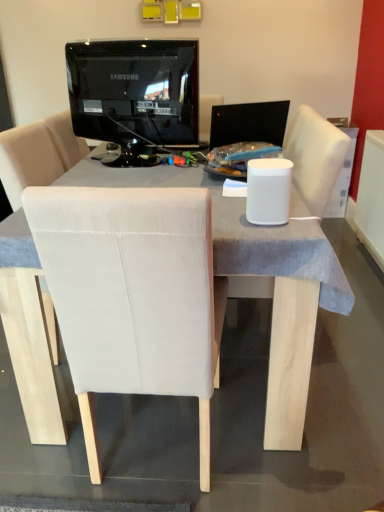
Question: Is black glossy monitor at upper center completely or partially outside of black glossy monitor at center?

Choices:
 (A) no
 (B) yes

Answer: (B)

Question: Does black glossy monitor at upper center lie in front of black glossy monitor at center?

Choices:
 (A) yes
 (B) no

Answer: (A)

Question: Can black glossy monitor at center be found inside black glossy monitor at upper center?

Choices:
 (A) yes
 (B) no

Answer: (B)

Question: Does black glossy monitor at upper center have a larger size compared to black glossy monitor at center?

Choices:
 (A) yes
 (B) no

Answer: (A)

Question: Does black glossy monitor at upper center appear on the right side of black glossy monitor at center?

Choices:
 (A) yes
 (B) no

Answer: (B)

Question: Is black glossy monitor at upper center shorter than black glossy monitor at center?

Choices:
 (A) no
 (B) yes

Answer: (A)

Question: Is black glossy monitor at center positioned behind white plastic radiator at right?

Choices:
 (A) no
 (B) yes

Answer: (A)

Question: Would you say black glossy monitor at center is a long distance from white plastic radiator at right?

Choices:
 (A) yes
 (B) no

Answer: (A)

Question: Is black glossy monitor at center at the right side of white plastic radiator at right?

Choices:
 (A) no
 (B) yes

Answer: (A)

Question: From a real-world perspective, is black glossy monitor at center below white plastic radiator at right?

Choices:
 (A) yes
 (B) no

Answer: (B)

Question: Is white plastic radiator at right inside black glossy monitor at center?

Choices:
 (A) no
 (B) yes

Answer: (A)

Question: Can you confirm if black glossy monitor at center is taller than white plastic radiator at right?

Choices:
 (A) no
 (B) yes

Answer: (A)

Question: Is black glossy monitor at center positioned behind black glossy monitor at upper center?

Choices:
 (A) no
 (B) yes

Answer: (B)